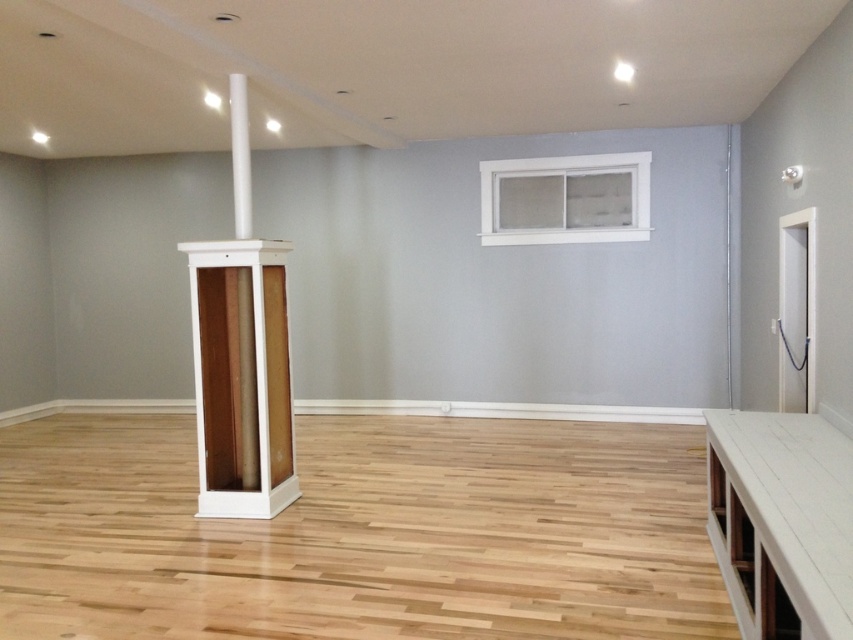
You are standing in the room and want to place a large painting between the white painted wood window at upper right and the white wood pillar at center. Based on their positions, where should the painting be placed?

The white painted wood window at upper right is positioned on the right side of the white wood pillar at center, so the painting should be placed to the right of the white wood pillar at center but to the left of the white painted wood window at upper right.

You are standing in the center of the room and want to place a new plant on the floor. The plant requires a spot that is at least 0.7 meters away from the white painted wood table at lower right. Based on the room layout, is there enough space to place the plant in the center of the room?

The white painted wood table at lower right is located at point [781,522]. The center of the room is at point [426,320]. The distance between these two points is sqrt. Since the required minimum distance is 0.7 meters, the plant can be placed in the center of the room as the distance is sufficient.

You are standing in the room and see two points marked on the floor. The first point is at coordinates point (759, 582) and the second is at point (236, 502). Which point is closer to you when facing the direction of the window?

Point (759, 582) is in front of point (236, 502), so when facing the window, point (759, 582) is closer to you.